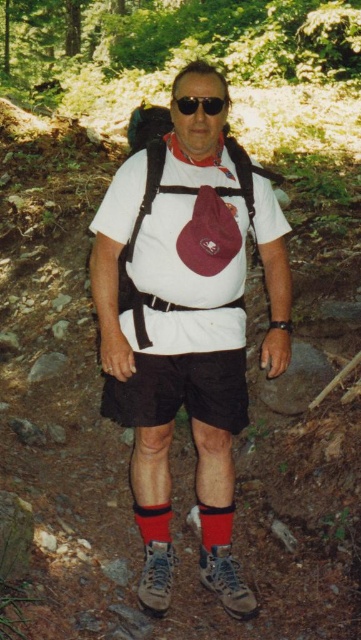
Question: Which of the following is the farthest from the observer?

Choices:
 (A) (225, 106)
 (B) (237, 426)

Answer: (B)

Question: Does white matte t-shirt at center appear on the right side of black cotton shorts at center?

Choices:
 (A) yes
 (B) no

Answer: (A)

Question: Where is black cotton shorts at center located in relation to black matte sunglasses at center in the image?

Choices:
 (A) right
 (B) left

Answer: (B)

Question: Which object appears closest to the camera in this image?

Choices:
 (A) black cotton shorts at center
 (B) white matte t-shirt at center
 (C) black matte sunglasses at center

Answer: (C)

Question: Does black cotton shorts at center appear over black matte sunglasses at center?

Choices:
 (A) no
 (B) yes

Answer: (A)

Question: Among these objects, which one is nearest to the camera?

Choices:
 (A) black matte sunglasses at center
 (B) black cotton shorts at center

Answer: (A)